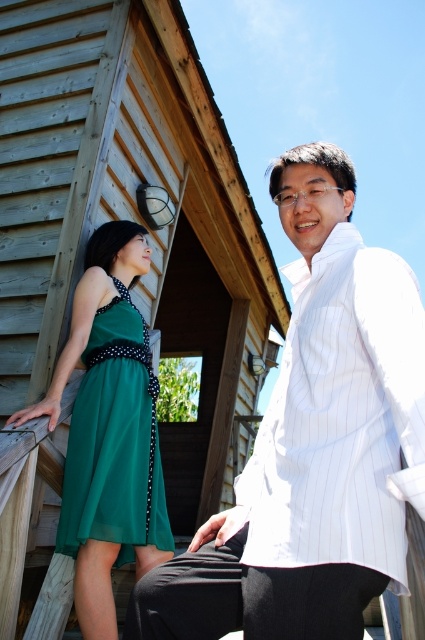
You are standing at the point marked as point (x=311, y=442). You want to reach the wooden structure behind the people. Which direction should you move to avoid stepping on the white striped shirt at right?

The white striped shirt at right is located at point (x=311, y=442). To avoid stepping on it, you should move away from the white striped shirt at right towards the wooden structure behind the people.

You are standing in front of the wooden structure and want to locate the point at coordinate (130, 214). Based on the scene description, where would this point be located?

The point at coordinate (130, 214) is on the wooden hut at upper left.